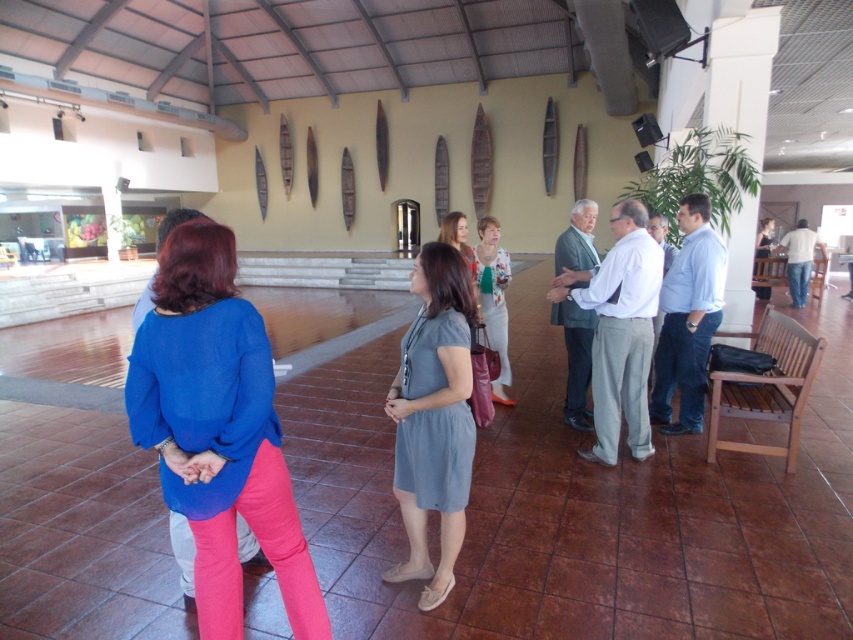
Between blue cotton blouse at center and floral print blouse at center, which one is positioned higher?

floral print blouse at center

Is blue cotton blouse at center wider than floral print blouse at center?

Yes, blue cotton blouse at center is wider than floral print blouse at center.

Does point (306, 545) come behind point (497, 324)?

No.

Where is `blue cotton blouse at center`? blue cotton blouse at center is located at coordinates (218, 429).

Does gray cotton dress at center have a lesser width compared to floral print blouse at center?

No.

Between point (421, 380) and point (498, 330), which one is positioned in front?

Point (421, 380) is in front.

The width and height of the screenshot is (853, 640). What are the coordinates of `gray cotton dress at center` in the screenshot? It's located at (433, 417).

Locate an element on the screen. The image size is (853, 640). gray cotton dress at center is located at coordinates (433, 417).

Does blue cotton blouse at center have a greater width compared to gray cotton dress at center?

Indeed, blue cotton blouse at center has a greater width compared to gray cotton dress at center.

Does point (144, 336) come farther from viewer compared to point (409, 417)?

That is False.

Which is behind, point (318, 611) or point (468, 353)?

Point (468, 353)

I want to click on blue cotton blouse at center, so click(218, 429).